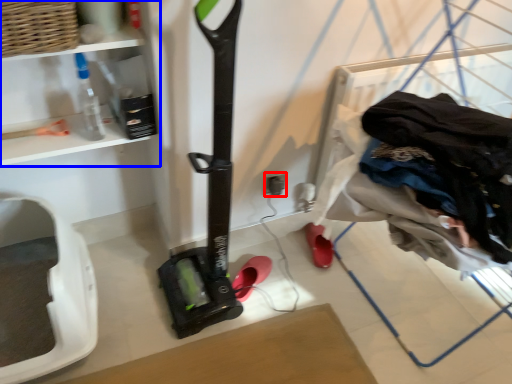
Question: Which point is further to the camera, electric outlet (highlighted by a red box) or shelf (highlighted by a blue box)?

Choices:
 (A) electric outlet
 (B) shelf

Answer: (A)